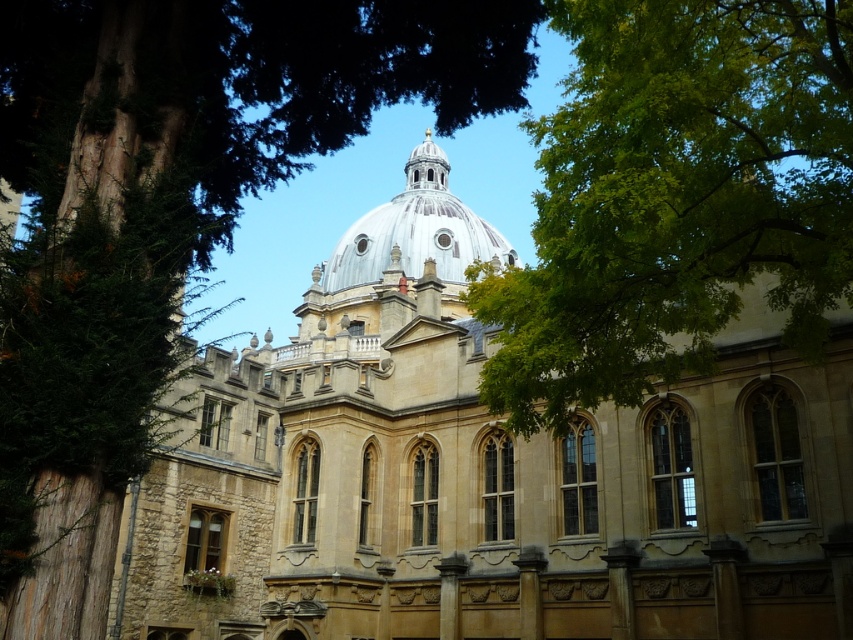
You are standing in front of the grand architectural structure and notice two points marked on the building. The first point is at coordinates point (811,385) and the second is at point (381,240). Which point is closer to your current position?

Point (811,385) is in front of point (381,240), so the first point is closer to your current position.

You are standing in front of the grand building and want to take a photo. You notice two points marked on the building facade at coordinates point (824, 531) and point (798, 97). Which point is closer to you when you look at the building?

Point (798, 97) is closer to you because it is less further to the camera than point (824, 531), which is further away.

Based on the scene description, where is the light brown stone church at center located in terms of its 2D coordinates?

The light brown stone church at center is located at the 2D coordinates point [485,474].